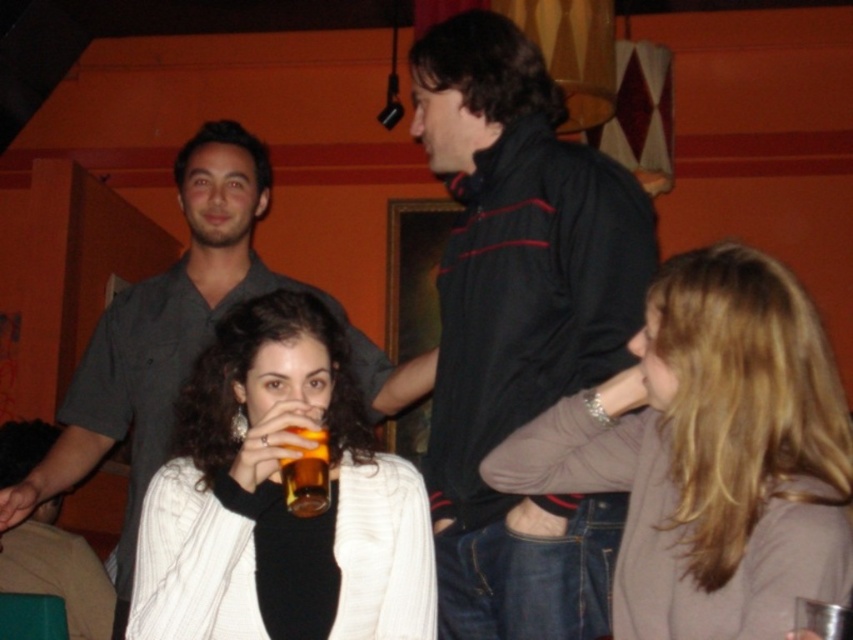
You are at a social gathering and want to hand a drink to the person in the dark gray shirt at center without accidentally giving it to the person in the black fleece jacket at center. Based on their positions, which direction should you approach from?

The black fleece jacket at center is located above the dark gray shirt at center. To avoid giving the drink to the wrong person, you should approach from below the black fleece jacket at center so that you can directly reach the dark gray shirt at center without interference.

You are a bartender at this event. You need to place a new drink order for the person wearing the dark gray shirt at center. The drink must be served in the translucent amber glass at center. Can you reach the glass without moving the shirt? The minimum reach distance required is 1.2 meters.

The dark gray shirt at center and the translucent amber glass at center are 1.26 meters apart. Since the minimum reach distance required is 1.2 meters, the bartender can reach the glass without moving the shirt as the distance is sufficient.